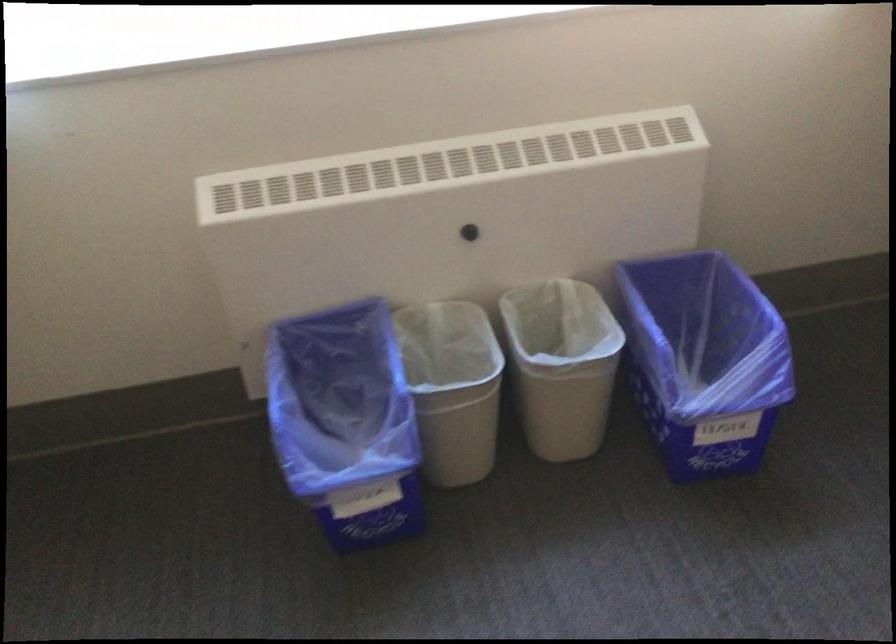
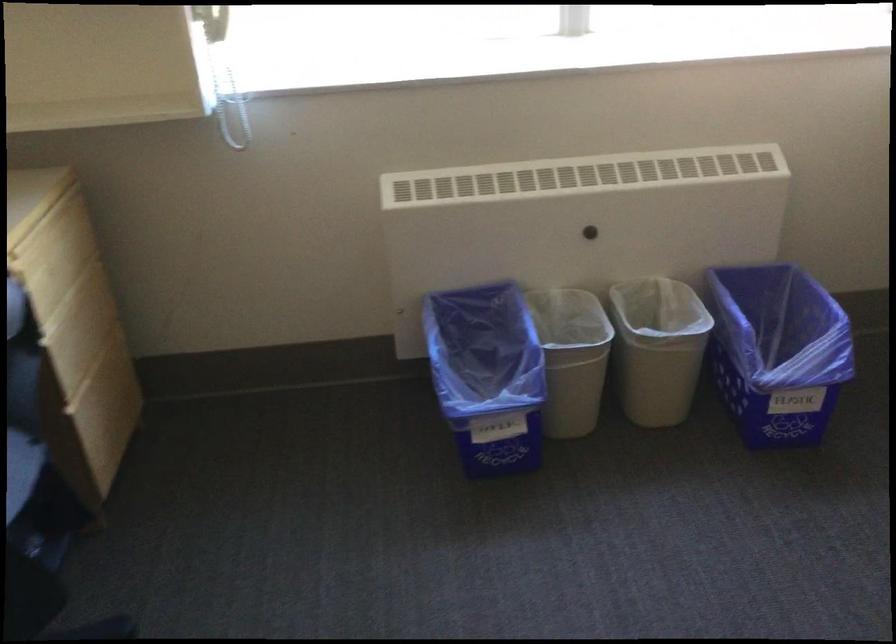
In the second image, find the point that corresponds to [355,406] in the first image.

(485, 364)